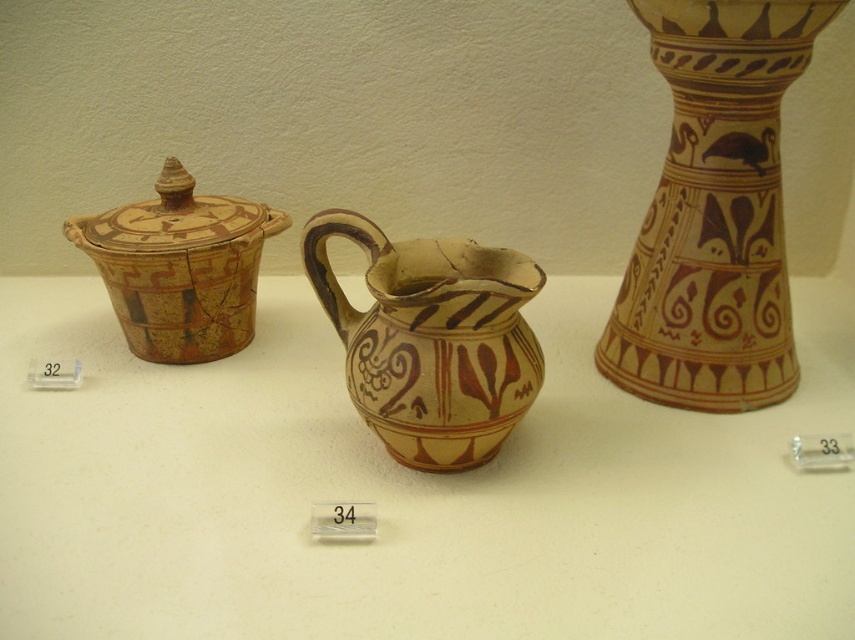
You are a museum visitor standing in front of the display. You want to locate the matte clay vase at right. Where should you look relative to the other vessels?

The matte clay vase at right is located at point 0.331 on the x axis and 0.836 on the y axis relative to the display area.

You are a museum visitor standing in front of the three vessels. You notice the matte ceramic pitcher at center and the matte clay vase at right. Which one is positioned lower in the display?

The matte ceramic pitcher at center is positioned lower than the matte clay vase at right.